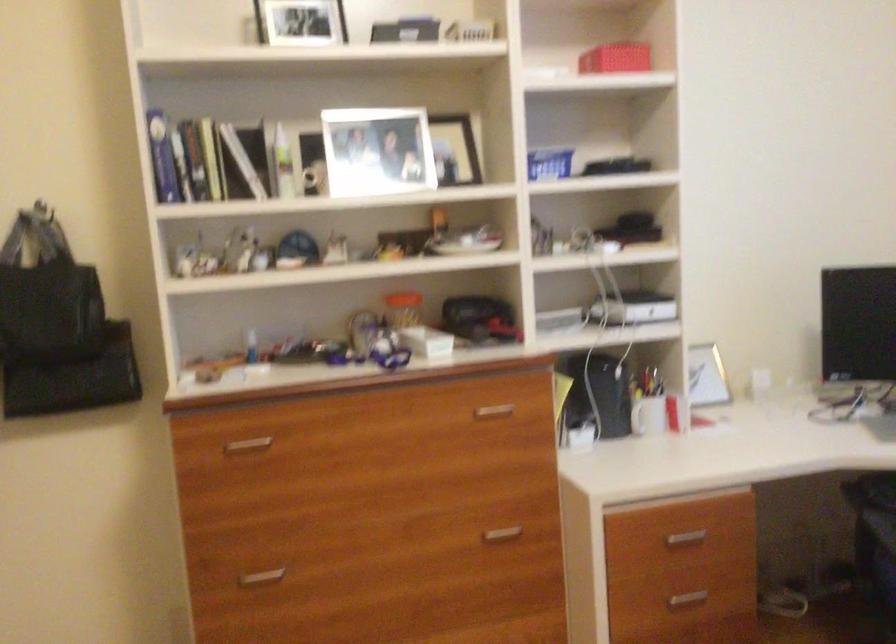
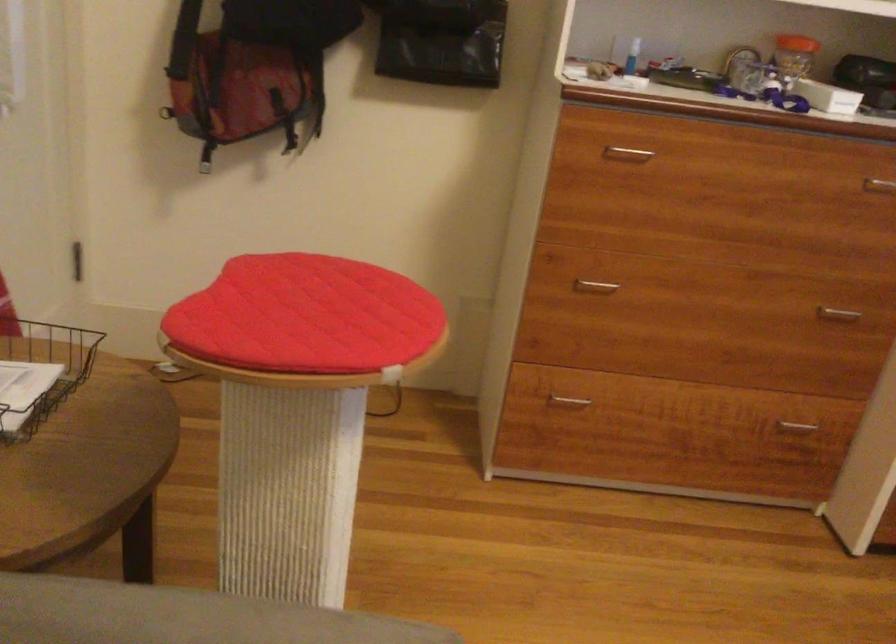
In the second image, find the point that corresponds to (x=409, y=305) in the first image.

(794, 53)